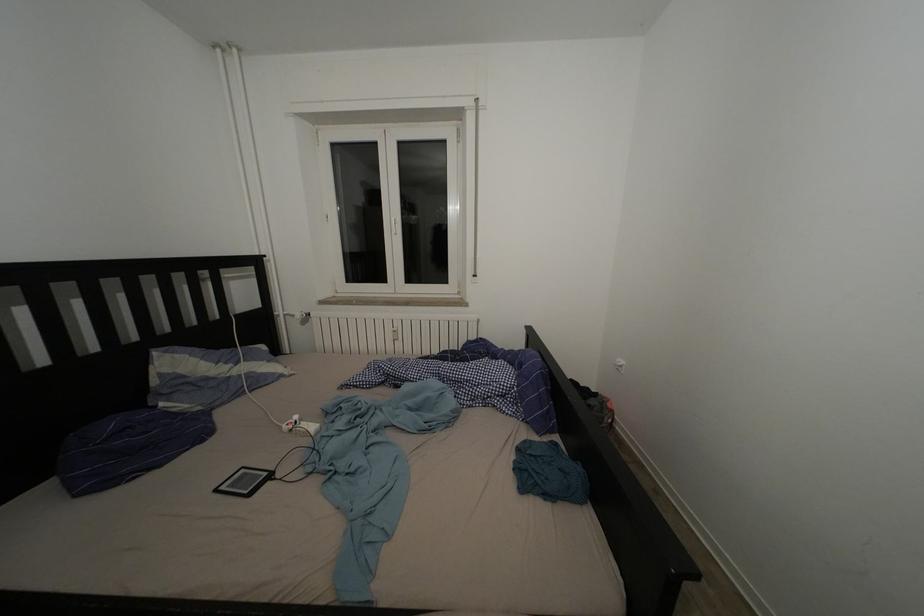
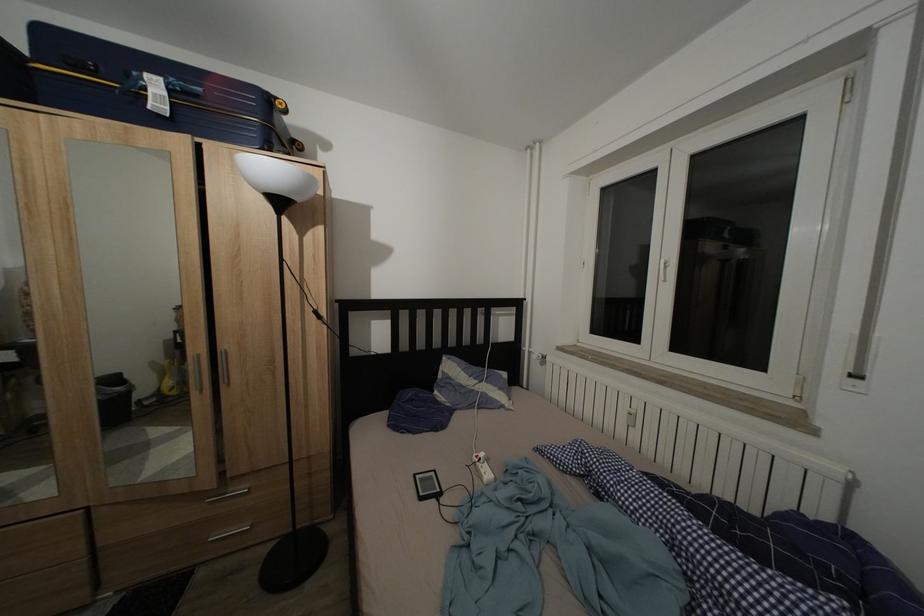
In the second image, find the point that corresponds to the point at 224,496 in the first image.

(422, 482)